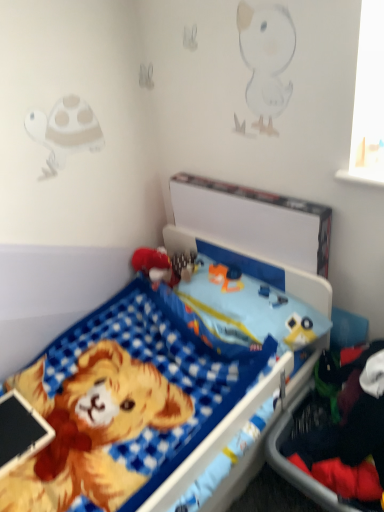
Question: From the image's perspective, is red plush toy at center over dark blue fabric at lower right?

Choices:
 (A) no
 (B) yes

Answer: (B)

Question: Considering the relative positions of red plush toy at center and dark blue fabric at lower right in the image provided, is red plush toy at center to the right of dark blue fabric at lower right from the viewer's perspective?

Choices:
 (A) no
 (B) yes

Answer: (A)

Question: Considering the relative sizes of red plush toy at center and dark blue fabric at lower right in the image provided, is red plush toy at center shorter than dark blue fabric at lower right?

Choices:
 (A) yes
 (B) no

Answer: (A)

Question: Are red plush toy at center and dark blue fabric at lower right located far from each other?

Choices:
 (A) yes
 (B) no

Answer: (B)

Question: Considering the relative positions of red plush toy at center and dark blue fabric at lower right in the image provided, is red plush toy at center in front of dark blue fabric at lower right?

Choices:
 (A) yes
 (B) no

Answer: (B)

Question: From the image's perspective, is blue checkered bed at center located above or below red plush toy at center?

Choices:
 (A) below
 (B) above

Answer: (A)

Question: Would you say blue checkered bed at center is to the left or to the right of red plush toy at center in the picture?

Choices:
 (A) left
 (B) right

Answer: (B)

Question: Considering the positions of point (193, 425) and point (150, 268), is point (193, 425) closer or farther from the camera than point (150, 268)?

Choices:
 (A) closer
 (B) farther

Answer: (A)

Question: Considering their positions, is blue checkered bed at center located in front of or behind red plush toy at center?

Choices:
 (A) front
 (B) behind

Answer: (A)

Question: Is point (334, 474) positioned closer to the camera than point (160, 270)?

Choices:
 (A) farther
 (B) closer

Answer: (B)

Question: In terms of width, does dark blue fabric at lower right look wider or thinner when compared to red plush toy at center?

Choices:
 (A) thin
 (B) wide

Answer: (B)

Question: From the image's perspective, relative to red plush toy at center, is dark blue fabric at lower right above or below?

Choices:
 (A) below
 (B) above

Answer: (A)

Question: Relative to red plush toy at center, is dark blue fabric at lower right in front or behind?

Choices:
 (A) front
 (B) behind

Answer: (A)

Question: In terms of width, does red plush toy at center look wider or thinner when compared to blue checkered bed at center?

Choices:
 (A) wide
 (B) thin

Answer: (B)

Question: Does point (145, 263) appear closer or farther from the camera than point (114, 438)?

Choices:
 (A) closer
 (B) farther

Answer: (B)